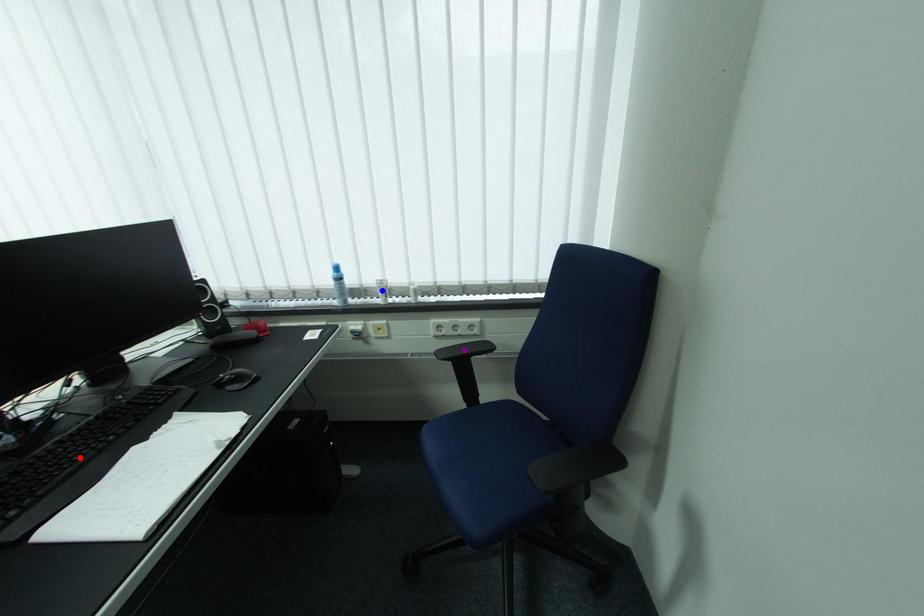
Order these from nearest to farthest:
purple point | red point | blue point

blue point < purple point < red point